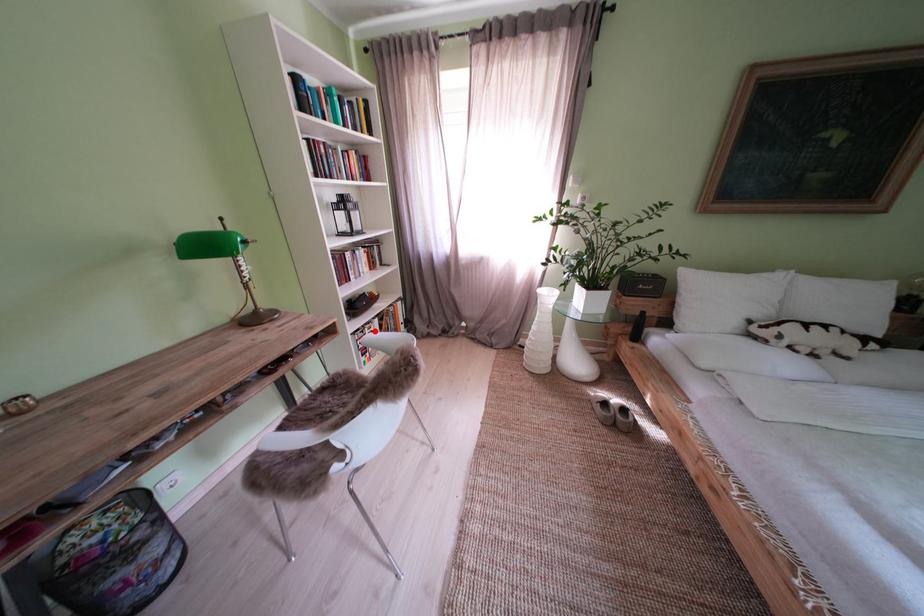
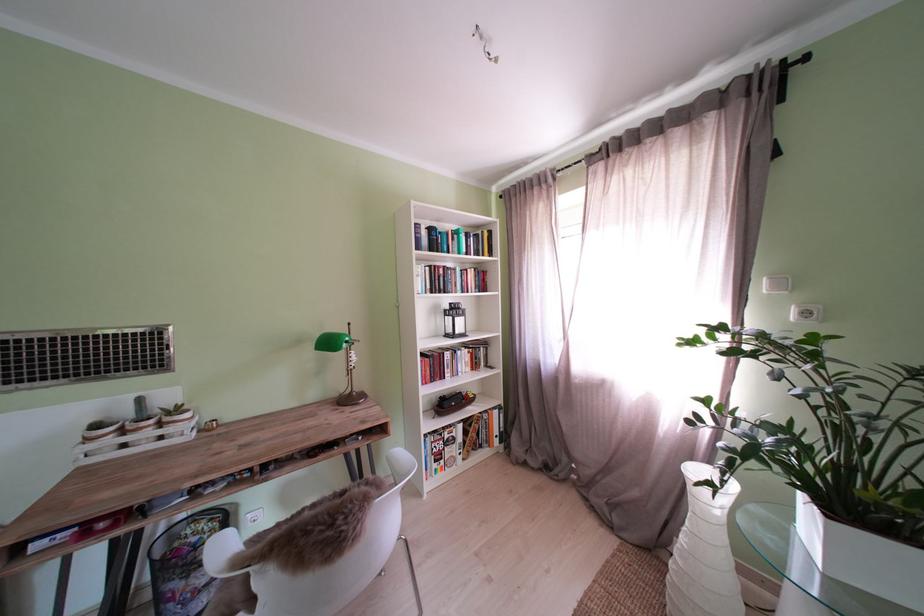
Find the pixel in the second image that matches the highlighted location in the first image.

(456, 434)